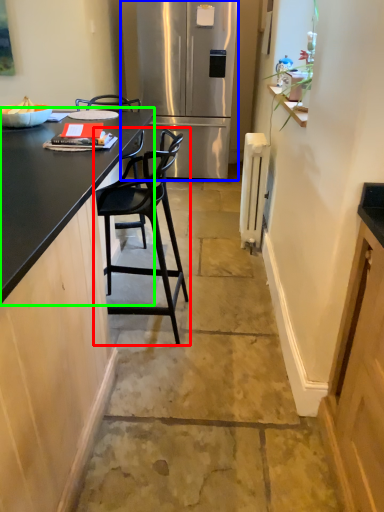
Question: Which is nearer to the chair (highlighted by a red box)? refrigerator (highlighted by a blue box) or countertop (highlighted by a green box).

Choices:
 (A) refrigerator
 (B) countertop

Answer: (B)